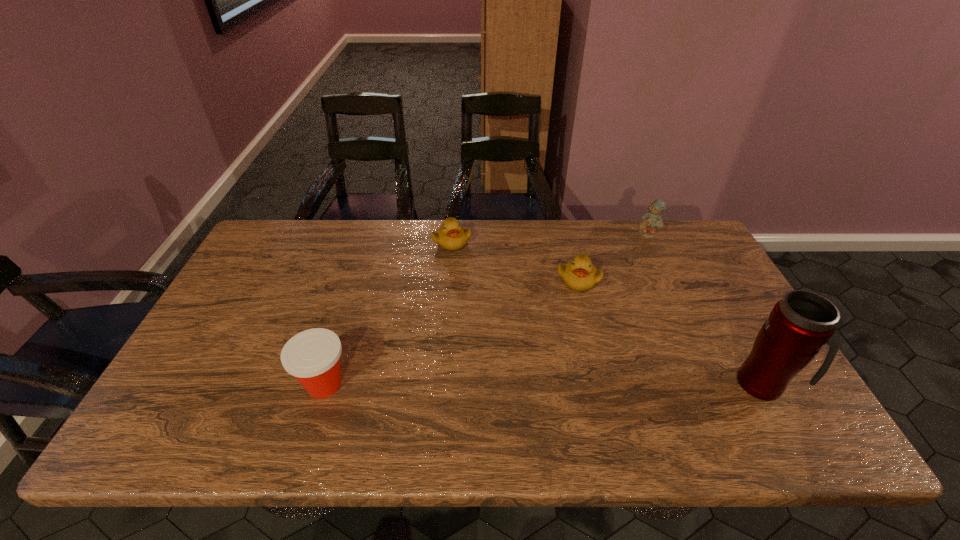
This screenshot has width=960, height=540. Find the location of `the leftmost object`. the leftmost object is located at coordinates (312, 356).

Where is `the tallest object`? This screenshot has height=540, width=960. the tallest object is located at coordinates (802, 322).

You are a GUI agent. You are given a task and a screenshot of the screen. Output one action in this format:
    pyautogui.click(x=<x>, y=<y>)
    Task: Click on the rightmost object
    The width and height of the screenshot is (960, 540).
    Given the screenshot: What is the action you would take?
    pyautogui.click(x=802, y=322)

I want to click on the right duckling, so click(580, 275).

Where is `the third object from left to right`? the third object from left to right is located at coordinates (580, 275).

Find the location of a particular element. The image size is (960, 540). the second object from left to right is located at coordinates (450, 236).

I want to click on the left duckling, so click(450, 236).

I want to click on teddy bear, so click(x=651, y=220).

The width and height of the screenshot is (960, 540). I want to click on free space located on the right of the Dixie cup, so click(421, 384).

At what (x,y) coordinates should I click in order to perform the action: click on free location located 0.130m on the front-facing side of the right duckling. Please return your answer as a coordinate pair (x, y). The width and height of the screenshot is (960, 540). Looking at the image, I should click on (584, 327).